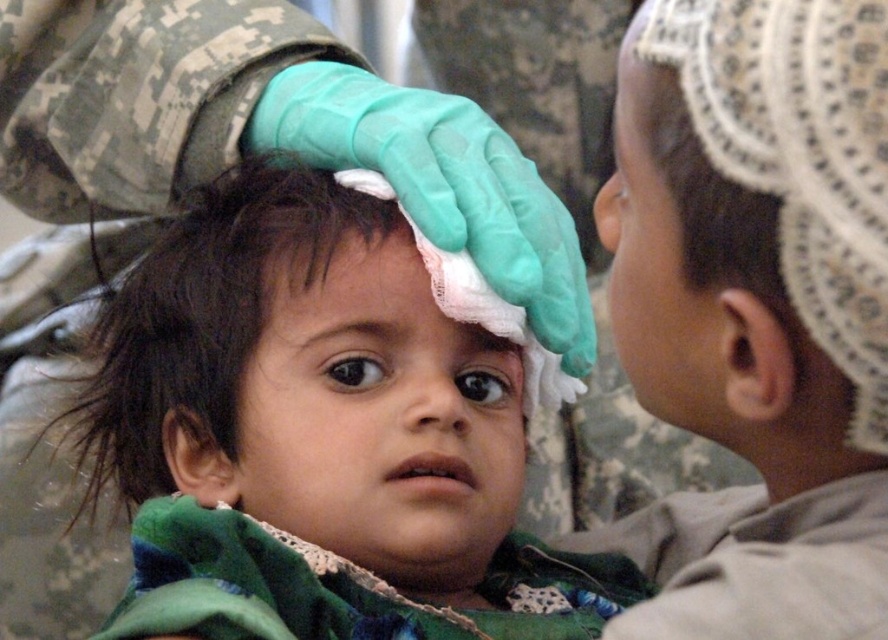
Question: From the image, what is the correct spatial relationship of white lace headscarf at upper right in relation to dark brown matte hair at center?

Choices:
 (A) right
 (B) left

Answer: (A)

Question: Which of the following is the farthest from the observer?

Choices:
 (A) dark brown hair at center
 (B) dark brown matte hair at center

Answer: (B)

Question: Estimate the real-world distances between objects in this image. Which object is farther from the white lace forehead at center?

Choices:
 (A) dark brown matte hair at center
 (B) dark brown hair at center

Answer: (B)

Question: Does dark brown matte hair at center come in front of white lace forehead at center?

Choices:
 (A) no
 (B) yes

Answer: (A)

Question: Which point appears farthest from the camera in this image?

Choices:
 (A) (660, 321)
 (B) (223, 264)

Answer: (B)

Question: Is dark brown hair at center in front of white lace headscarf at upper right?

Choices:
 (A) yes
 (B) no

Answer: (B)